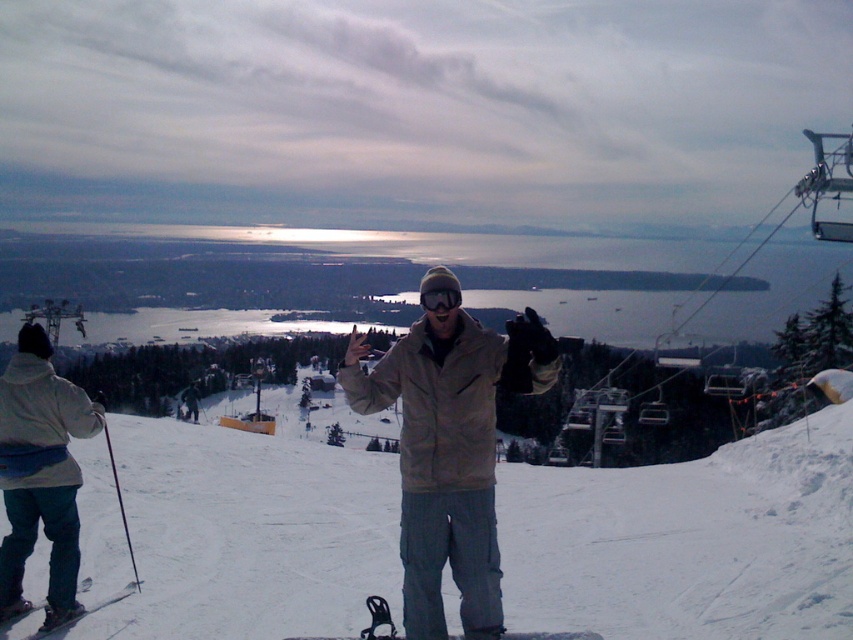
You are a photographer trying to capture a closeup shot of the beige textured jacket at center and the black matte goggles at center. Which object should you zoom in on more to ensure both are in focus?

The beige textured jacket at center has a larger size compared to black matte goggles at center, so you should zoom in more on the black matte goggles at center to ensure both are in focus.

You are a photographer trying to capture the perfect shot of the beige textured jacket at center and the black matte goggles at center. Based on their positions, which object should you adjust your camera focus to first to ensure both are in frame?

Since the beige textured jacket at center is to the right of the black matte goggles at center, you should focus on the black matte goggles at center first to ensure both are within the camera frame.

You are standing at the point marked by the coordinates point (39, 474) in the image. What object is located at that point?

The point (39, 474) indicates the white fleece jacket at lower left.